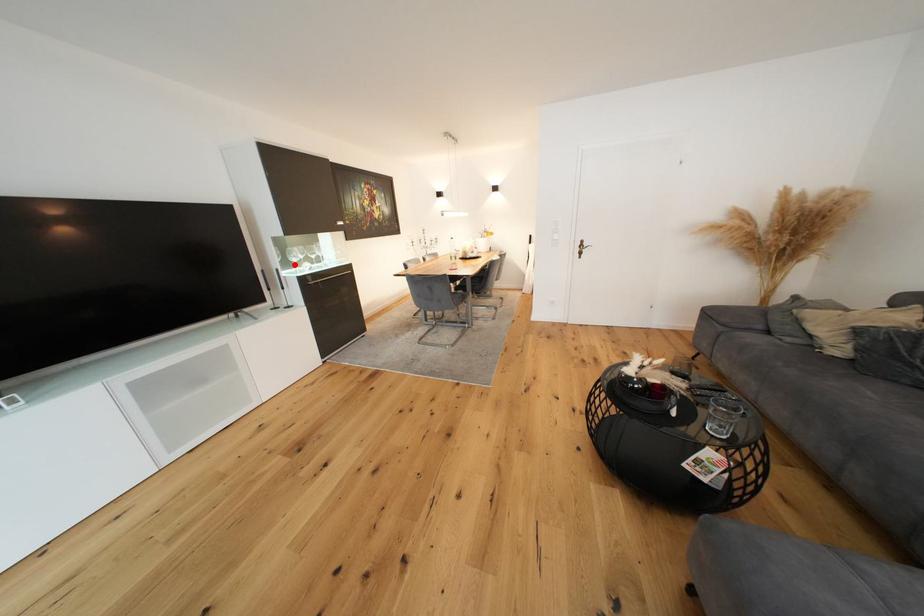
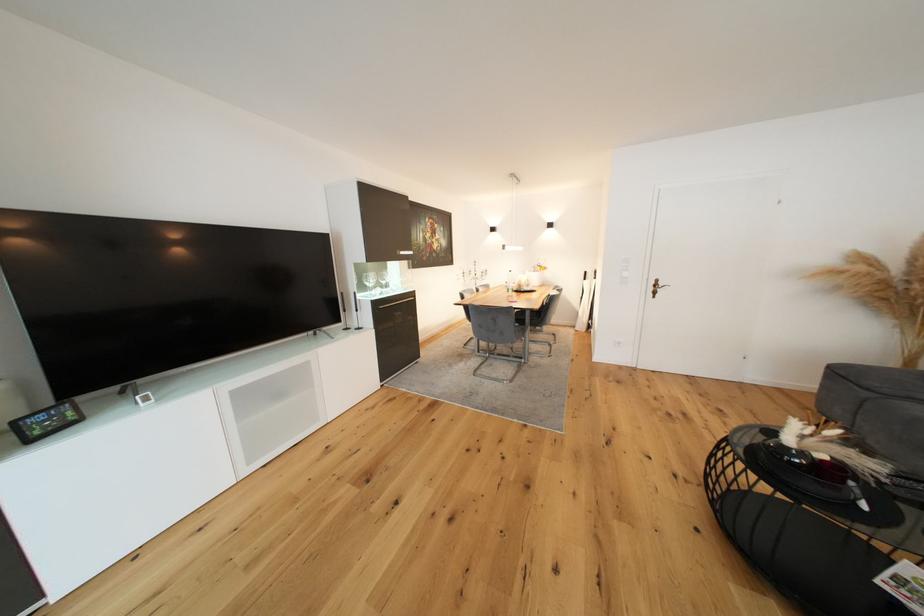
Find the pixel in the second image that matches the highlighted location in the first image.

(370, 289)